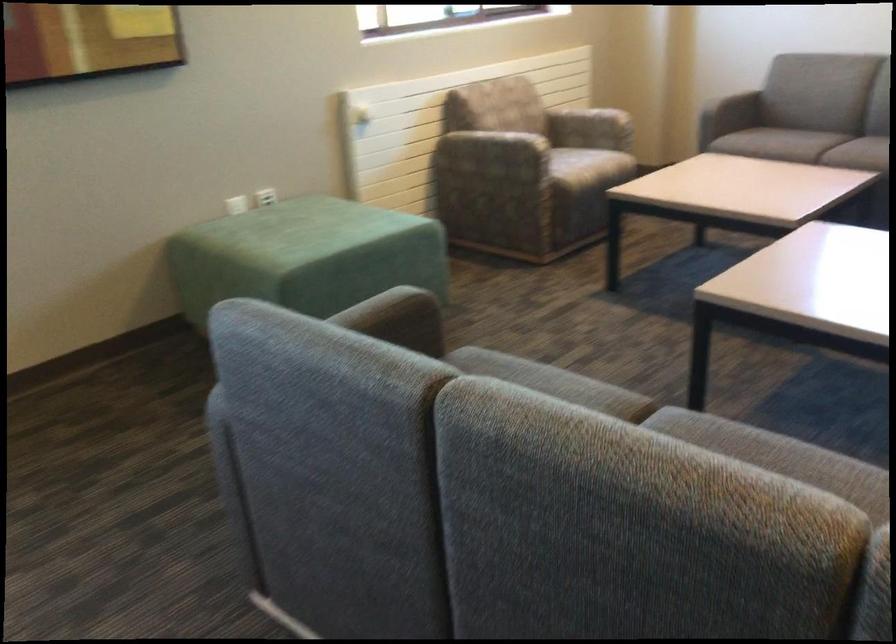
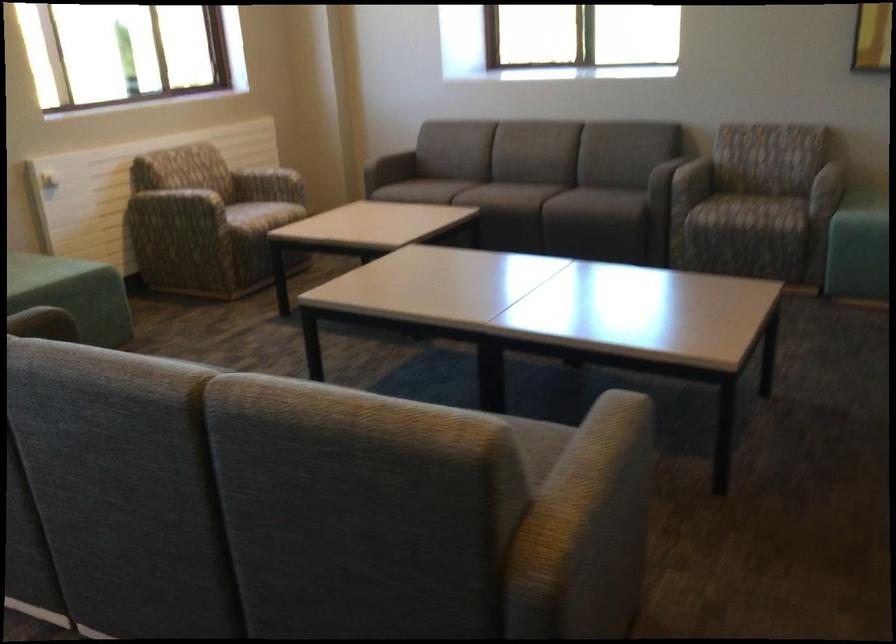
In the second image, find the point that corresponds to (x=502, y=144) in the first image.

(179, 204)